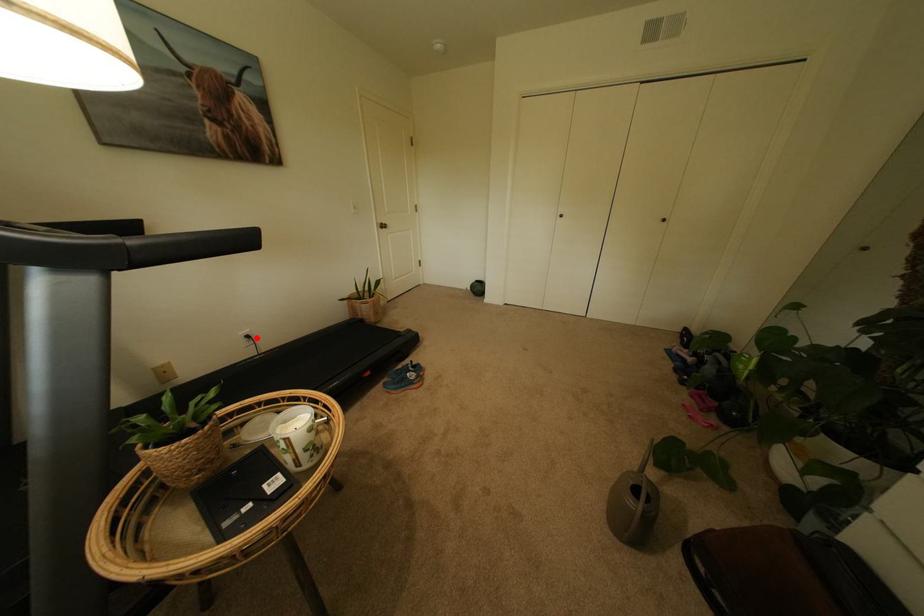
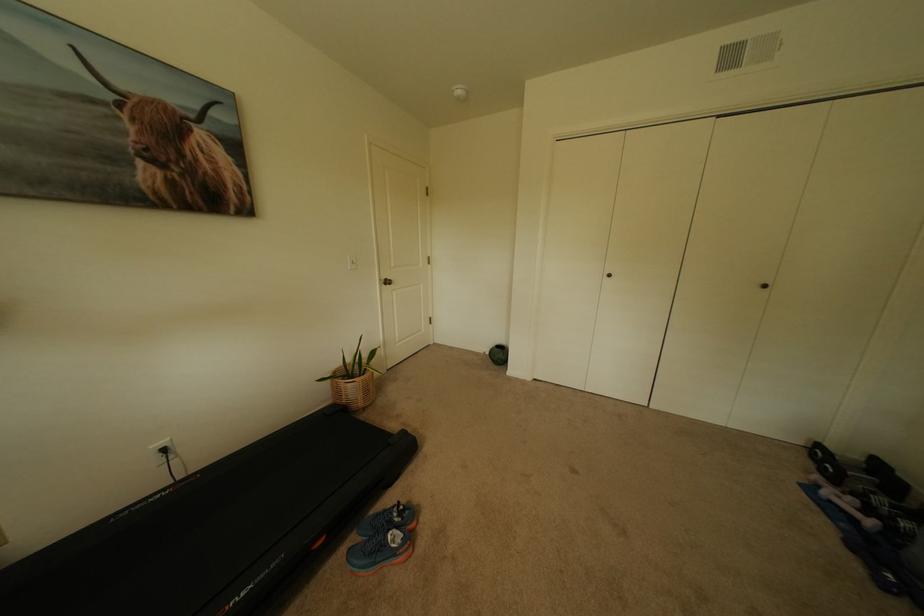
Question: I am providing you with two images of the same scene from different viewpoints. A red point is shown in image1. For the corresponding object point in image2, is it positioned nearer or farther from the camera?

Choices:
 (A) Nearer
 (B) Farther

Answer: (B)